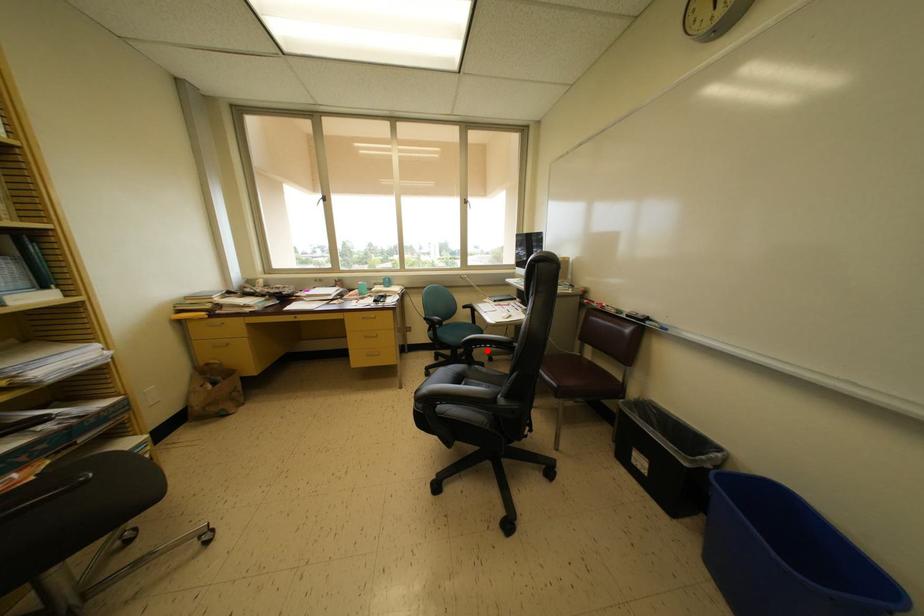
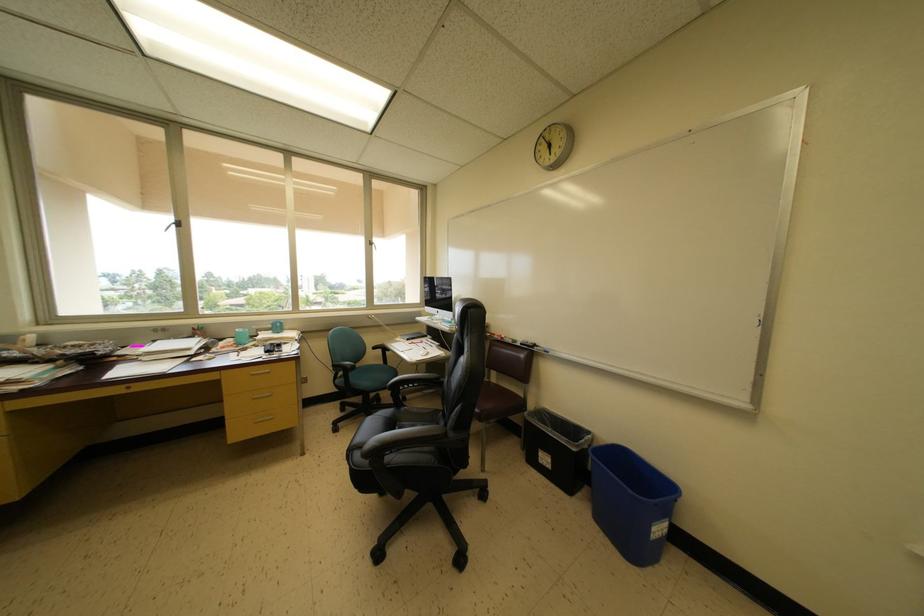
Question: I am providing you with two images of the same scene from different viewpoints. In image1, a red point is highlighted. Considering the same 3D point in image2, which of the following is correct?

Choices:
 (A) It is closer
 (B) It is farther

Answer: (A)